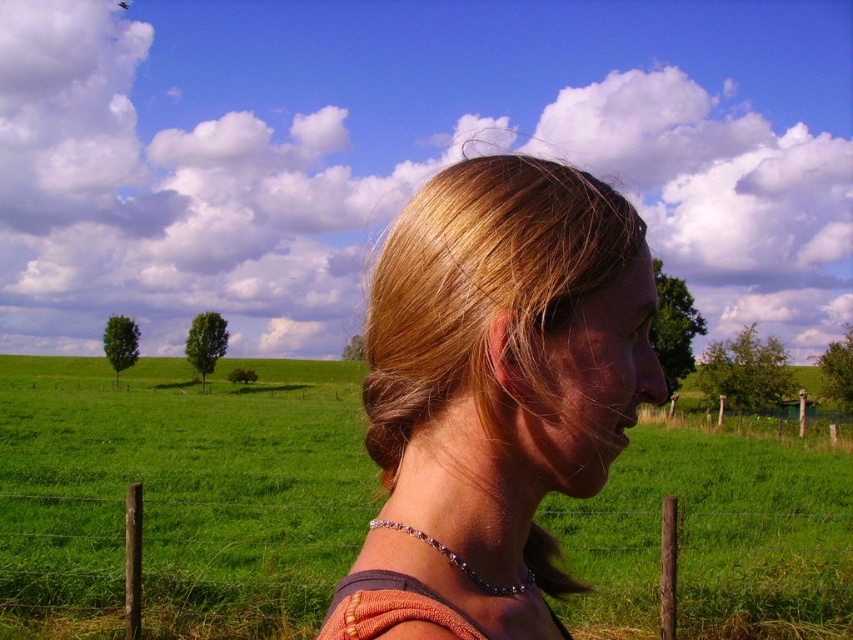
Question: Among these points, which one is farthest from the camera?

Choices:
 (A) (421, 257)
 (B) (219, 528)

Answer: (B)

Question: Does blonde hair at center appear on the left side of wooden post at lower right?

Choices:
 (A) yes
 (B) no

Answer: (A)

Question: Is blonde hair at center bigger than wooden post at lower right?

Choices:
 (A) yes
 (B) no

Answer: (B)

Question: Which point is farther from the camera taking this photo?

Choices:
 (A) (473, 412)
 (B) (323, 522)

Answer: (B)

Question: Is blonde hair at center further to camera compared to wooden post at lower right?

Choices:
 (A) yes
 (B) no

Answer: (B)

Question: Which point appears closest to the camera in this image?

Choices:
 (A) (556, 385)
 (B) (158, 541)

Answer: (A)